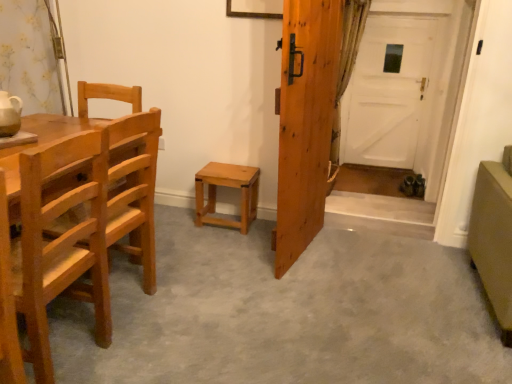
The image size is (512, 384). Find the location of `vacant area that lies in front of light brown wood stool at center`. vacant area that lies in front of light brown wood stool at center is located at coordinates (x=221, y=238).